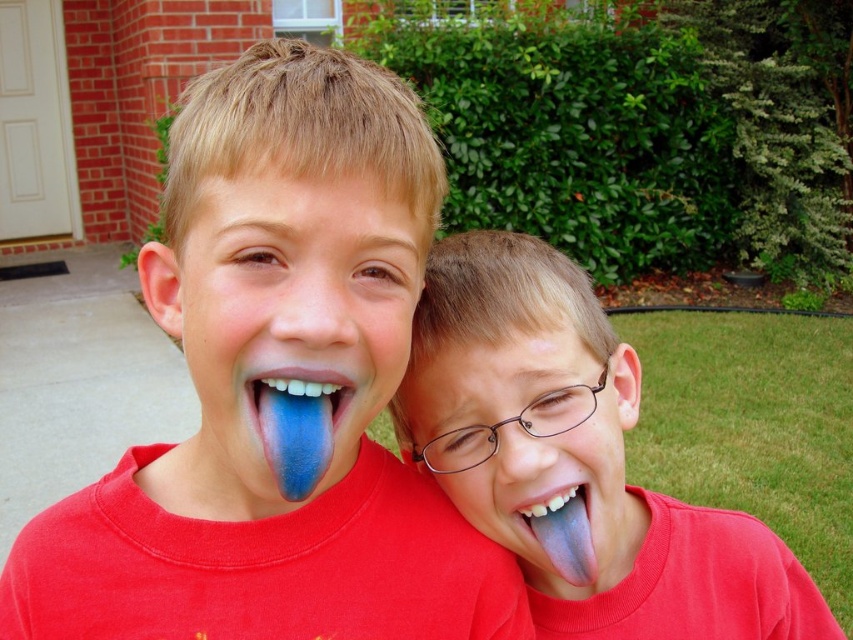
You are a dentist examining the image of two boys. You notice the blue glossy tongue at center and the blue rubber tongue at right. Which object is covering part of the other?

The blue glossy tongue at center is positioned over the blue rubber tongue at right, so it is covering part of it.

You are a photographer trying to capture the boys in the scene. You notice the blue painted tongue at center and the blue rubber tongue at center. Which one is closer to the camera?

The blue painted tongue at center is closer to the camera because it is in front of the blue rubber tongue at center.